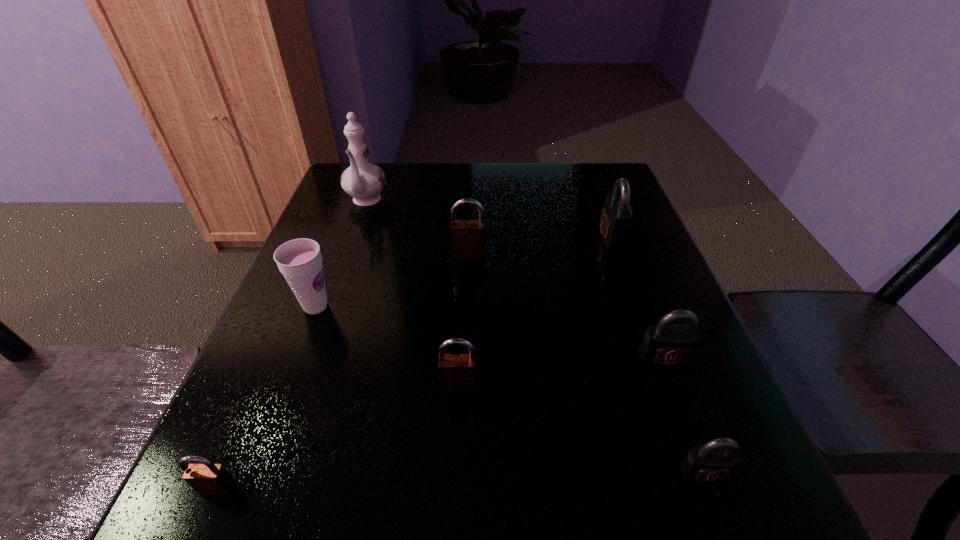
In order to click on the second nearest gray padlock in this screenshot , I will do `click(664, 345)`.

Where is `the second smallest gray padlock`? Image resolution: width=960 pixels, height=540 pixels. the second smallest gray padlock is located at coordinates (664, 345).

Locate an element on the screen. the nearest gray padlock is located at coordinates (716, 460).

What are the coordinates of `the smallest brown padlock` in the screenshot? It's located at (207, 478).

The image size is (960, 540). Identify the location of the nearest brown padlock. click(x=207, y=478).

This screenshot has width=960, height=540. I want to click on free space located 0.150m at the spout of the farthest object, so click(x=348, y=255).

Find the location of a particular element. This screenshot has width=960, height=540. blank space located 0.100m on the front of the farthest padlock near the keyhole is located at coordinates (558, 235).

This screenshot has height=540, width=960. I want to click on vacant space positioned on the front of the farthest padlock near the keyhole, so click(538, 235).

Find the location of `free region located 0.140m on the front of the farthest padlock near the keyhole`. free region located 0.140m on the front of the farthest padlock near the keyhole is located at coordinates (541, 235).

This screenshot has height=540, width=960. Find the location of `free space located 0.300m on the front-facing side of the biggest brown padlock`. free space located 0.300m on the front-facing side of the biggest brown padlock is located at coordinates (466, 369).